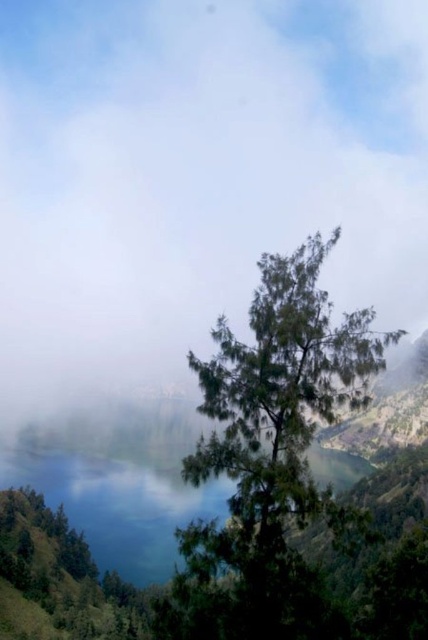
In the scene shown: Can you confirm if white fluffy morning fog at center is taller than green leafy tree at center?

Yes.

Who is more distant from viewer, (12, 362) or (223, 531)?

Positioned behind is point (12, 362).

Is point (318, 148) more distant than point (190, 573)?

Yes, it is behind point (190, 573).

In order to click on white fluffy morning fog at center in this screenshot , I will do `click(196, 179)`.